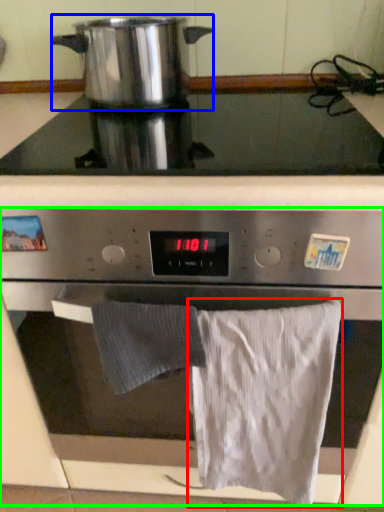
Question: Estimate the real-world distances between objects in this image. Which object is farther from bath towel (highlighted by a red box), kitchen appliance (highlighted by a blue box) or oven (highlighted by a green box)?

Choices:
 (A) kitchen appliance
 (B) oven

Answer: (A)